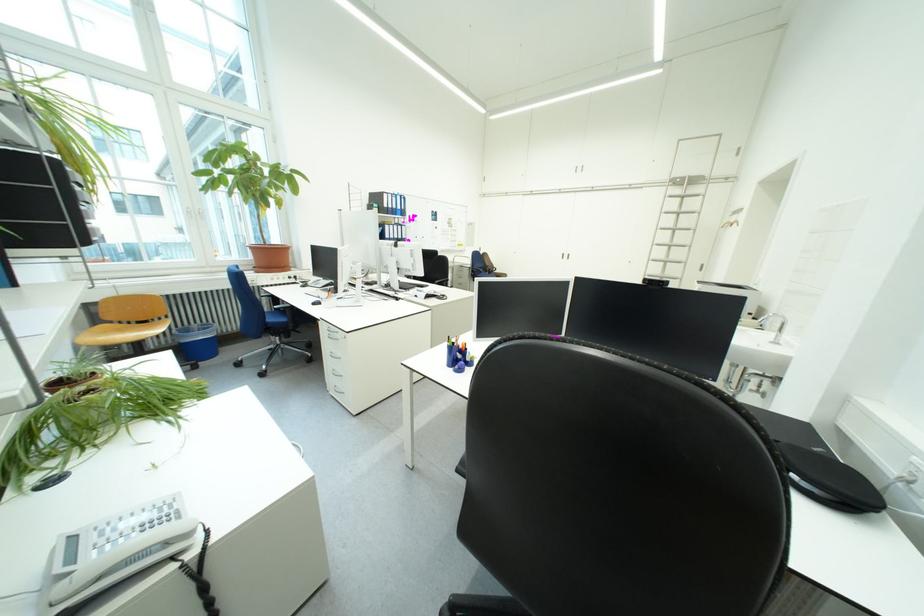
Identify the location of terracotta plant pot. (271, 257).